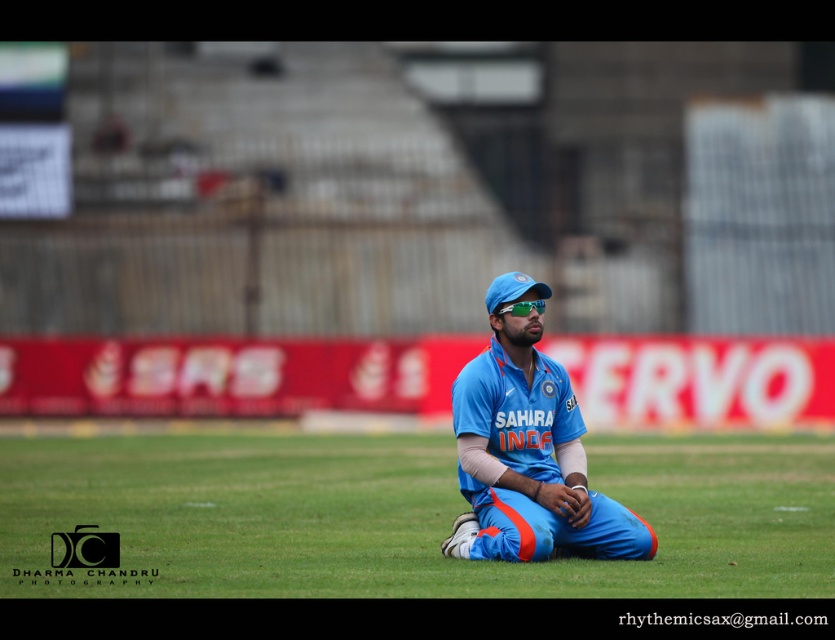
Is green grass at center shorter than blue fabric uniform at center?

Indeed, green grass at center has a lesser height compared to blue fabric uniform at center.

Who is more forward, (x=368, y=452) or (x=499, y=337)?

Point (x=499, y=337) is in front.

Find the location of a particular element. green grass at center is located at coordinates (403, 516).

Between point (553, 396) and point (510, 292), which one is positioned behind?

Positioned behind is point (553, 396).

Does point (501, 324) lie behind point (486, 308)?

That is False.

This screenshot has height=640, width=835. In order to click on blue fabric uniform at center in this screenshot , I will do `click(529, 456)`.

Can you confirm if green grass at center is thinner than blue fabric baseball cap at center?

No, green grass at center is not thinner than blue fabric baseball cap at center.

The image size is (835, 640). I want to click on green grass at center, so click(x=403, y=516).